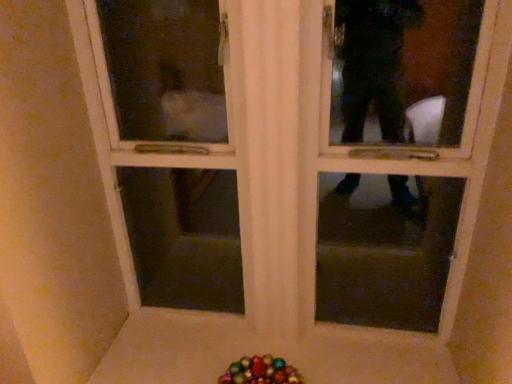
Identify the location of free location to the left of multicolored glass beads at lower center. The image size is (512, 384). (199, 365).